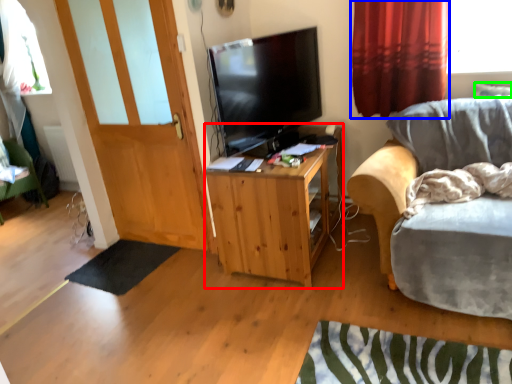
Question: Which object is positioned closest to cabinetry (highlighted by a red box)? Select from curtain (highlighted by a blue box) and pillow (highlighted by a green box).

Choices:
 (A) curtain
 (B) pillow

Answer: (A)